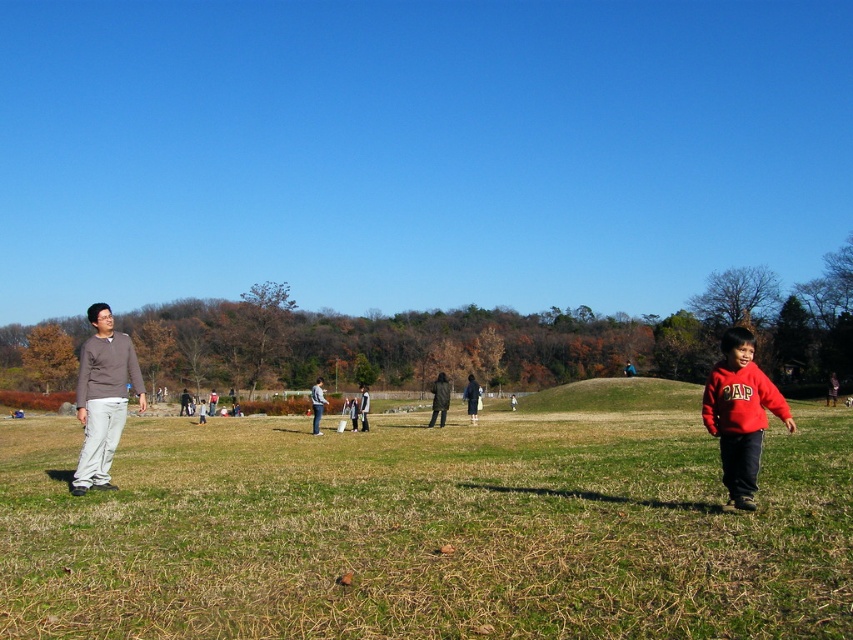
You are a photographer trying to capture a clear shot of the red fleece sweatshirt at lower right and the denim jacket at center. Since you want both subjects in focus, which one should you adjust your camera focus on first?

The red fleece sweatshirt at lower right is in front of the denim jacket at center, so you should focus on the red fleece sweatshirt at lower right first to ensure both are in focus.

In the park scene, there is a red fleece sweatshirt at lower right and a dark gray jacket at center. From the perspective of an observer looking at the image, which object is positioned more to the right?

The red fleece sweatshirt at lower right is positioned more to the right than the dark gray jacket at center.